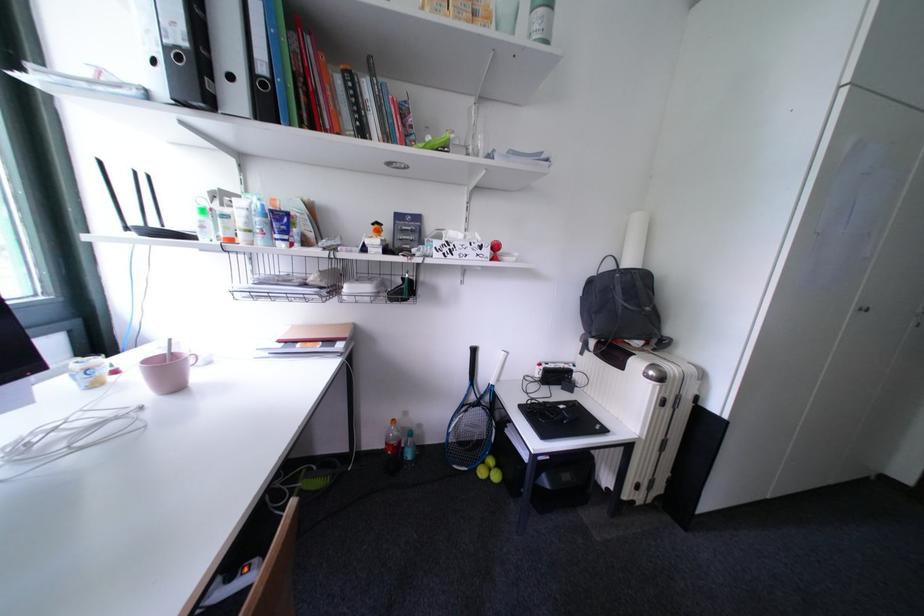
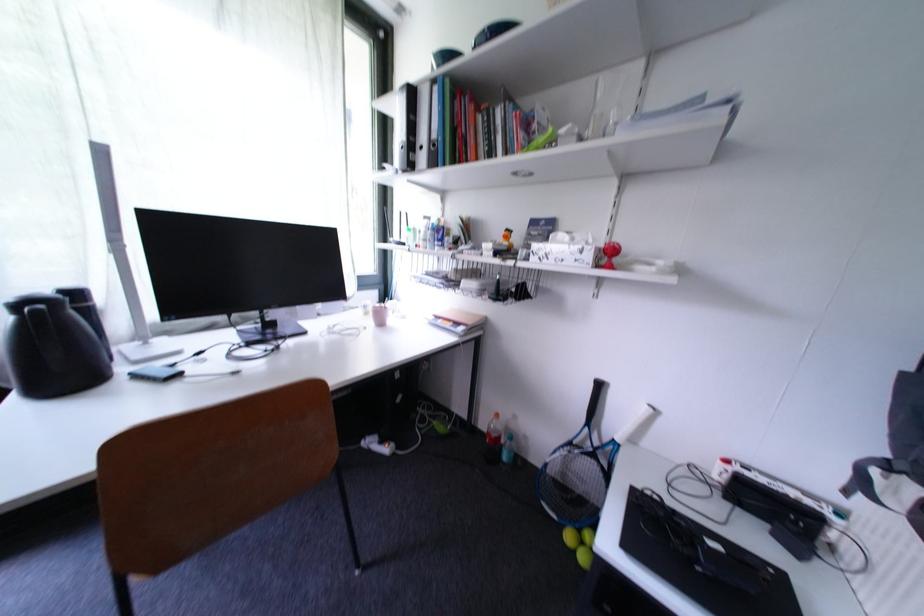
In the second image, find the point that corresponds to [489,249] in the first image.

(590, 253)